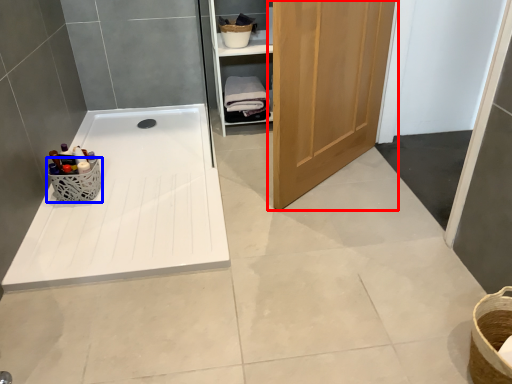
Question: Which of the following is the farthest to the observer, door (highlighted by a red box) or basket (highlighted by a blue box)?

Choices:
 (A) door
 (B) basket

Answer: (B)